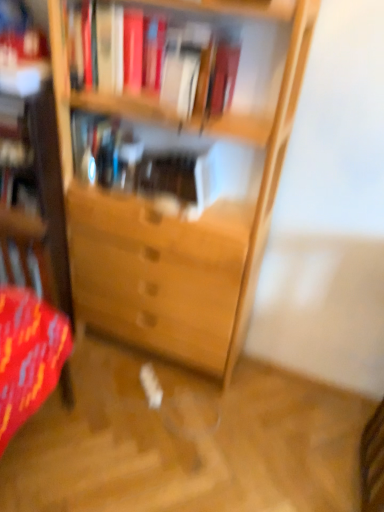
Locate an element on the screen. This screenshot has width=384, height=512. translucent glass vase at center, placed as the first book when sorted from back to front is located at coordinates (105, 151).

What do you see at coordinates (105, 151) in the screenshot? I see `translucent glass vase at center, which is counted as the second book, starting from the front` at bounding box center [105, 151].

Measure the distance between point (83, 142) and camera.

1.45 meters.

Describe the element at coordinates (160, 70) in the screenshot. I see `hardcover books at upper center, the second book viewed from the back` at that location.

This screenshot has height=512, width=384. I want to click on hardcover books at upper center, the second book viewed from the back, so click(160, 70).

Locate an element on the screen. This screenshot has height=512, width=384. translucent glass vase at center, placed as the first book when sorted from back to front is located at coordinates [105, 151].

Considering the positions of objects hardcover books at upper center, which is the first book in front-to-back order, and translucent glass vase at center, which is counted as the second book, starting from the front, in the image provided, who is more to the left, hardcover books at upper center, which is the first book in front-to-back order, or translucent glass vase at center, which is counted as the second book, starting from the front,?

Positioned to the left is translucent glass vase at center, which is counted as the second book, starting from the front.

In the scene shown: Is hardcover books at upper center, which is the first book in front-to-back order, closer to camera compared to translucent glass vase at center, placed as the first book when sorted from back to front?

Yes, the depth of hardcover books at upper center, which is the first book in front-to-back order, is less than that of translucent glass vase at center, placed as the first book when sorted from back to front.

Considering the positions of points (194, 65) and (126, 190), is point (194, 65) farther from camera compared to point (126, 190)?

No, (194, 65) is closer to viewer.

From the image's perspective, which is below, hardcover books at upper center, which is the first book in front-to-back order, or translucent glass vase at center, placed as the first book when sorted from back to front?

translucent glass vase at center, placed as the first book when sorted from back to front, is shown below in the image.

From a real-world perspective, between hardcover books at upper center, the second book viewed from the back, and translucent glass vase at center, placed as the first book when sorted from back to front, who is vertically higher?

hardcover books at upper center, the second book viewed from the back, from a real-world perspective.

Considering the sizes of hardcover books at upper center, the second book viewed from the back, and translucent glass vase at center, placed as the first book when sorted from back to front, in the image, is hardcover books at upper center, the second book viewed from the back, wider or thinner than translucent glass vase at center, placed as the first book when sorted from back to front,?

hardcover books at upper center, the second book viewed from the back, is wider than translucent glass vase at center, placed as the first book when sorted from back to front.

Looking at this image, in terms of height, does hardcover books at upper center, the second book viewed from the back, look taller or shorter compared to translucent glass vase at center, placed as the first book when sorted from back to front?

In the image, hardcover books at upper center, the second book viewed from the back, appears to be taller than translucent glass vase at center, placed as the first book when sorted from back to front.

Does hardcover books at upper center, which is the first book in front-to-back order, have a smaller size compared to translucent glass vase at center, which is counted as the second book, starting from the front?

Actually, hardcover books at upper center, which is the first book in front-to-back order, might be larger than translucent glass vase at center, which is counted as the second book, starting from the front.

Can translucent glass vase at center, which is counted as the second book, starting from the front, be found inside hardcover books at upper center, the second book viewed from the back?

No, translucent glass vase at center, which is counted as the second book, starting from the front, is located outside of hardcover books at upper center, the second book viewed from the back.

Is hardcover books at upper center, the second book viewed from the back, touching translucent glass vase at center, placed as the first book when sorted from back to front?

hardcover books at upper center, the second book viewed from the back, and translucent glass vase at center, placed as the first book when sorted from back to front, are not in contact.

Could you tell me if hardcover books at upper center, the second book viewed from the back, is facing translucent glass vase at center, which is counted as the second book, starting from the front?

No, hardcover books at upper center, the second book viewed from the back, does not turn towards translucent glass vase at center, which is counted as the second book, starting from the front.

Find the location of a particular element. book above the translucent glass vase at center, which is counted as the second book, starting from the front (from a real-world perspective) is located at coordinates (160, 70).

Which is more to the right, translucent glass vase at center, which is counted as the second book, starting from the front, or hardcover books at upper center, the second book viewed from the back?

hardcover books at upper center, the second book viewed from the back, is more to the right.

From the picture: Is the position of translucent glass vase at center, which is counted as the second book, starting from the front, less distant than that of hardcover books at upper center, which is the first book in front-to-back order?

No.

Which is farther from the camera, (83, 170) or (100, 106)?

The point (83, 170) is farther.

From the image's perspective, is translucent glass vase at center, placed as the first book when sorted from back to front, on hardcover books at upper center, the second book viewed from the back?

Actually, translucent glass vase at center, placed as the first book when sorted from back to front, appears below hardcover books at upper center, the second book viewed from the back, in the image.

From a real-world perspective, between translucent glass vase at center, placed as the first book when sorted from back to front, and hardcover books at upper center, the second book viewed from the back, who is vertically lower?

From a 3D spatial view, translucent glass vase at center, placed as the first book when sorted from back to front, is below.

Considering the relative sizes of translucent glass vase at center, placed as the first book when sorted from back to front, and hardcover books at upper center, the second book viewed from the back, in the image provided, is translucent glass vase at center, placed as the first book when sorted from back to front, wider than hardcover books at upper center, the second book viewed from the back,?

Incorrect, the width of translucent glass vase at center, placed as the first book when sorted from back to front, does not surpass that of hardcover books at upper center, the second book viewed from the back.

Does translucent glass vase at center, placed as the first book when sorted from back to front, have a lesser height compared to hardcover books at upper center, which is the first book in front-to-back order?

Yes, translucent glass vase at center, placed as the first book when sorted from back to front, is shorter than hardcover books at upper center, which is the first book in front-to-back order.

Looking at this image, which of these two, translucent glass vase at center, placed as the first book when sorted from back to front, or hardcover books at upper center, which is the first book in front-to-back order, is bigger?

hardcover books at upper center, which is the first book in front-to-back order.

Would you say translucent glass vase at center, which is counted as the second book, starting from the front, is inside or outside hardcover books at upper center, which is the first book in front-to-back order?

translucent glass vase at center, which is counted as the second book, starting from the front, is spatially situated outside hardcover books at upper center, which is the first book in front-to-back order.

Would you consider translucent glass vase at center, which is counted as the second book, starting from the front, to be distant from hardcover books at upper center, the second book viewed from the back?

Actually, translucent glass vase at center, which is counted as the second book, starting from the front, and hardcover books at upper center, the second book viewed from the back, are a little close together.

Is translucent glass vase at center, which is counted as the second book, starting from the front, facing towards hardcover books at upper center, the second book viewed from the back?

No, translucent glass vase at center, which is counted as the second book, starting from the front, is not aimed at hardcover books at upper center, the second book viewed from the back.

Looking at this image, what's the angular difference between translucent glass vase at center, which is counted as the second book, starting from the front, and hardcover books at upper center, which is the first book in front-to-back order,'s facing directions?

translucent glass vase at center, which is counted as the second book, starting from the front, and hardcover books at upper center, which is the first book in front-to-back order, are facing 0.00168 degrees away from each other.

This screenshot has width=384, height=512. Identify the location of book behind the hardcover books at upper center, which is the first book in front-to-back order. (105, 151).

This screenshot has width=384, height=512. Identify the location of book below the hardcover books at upper center, the second book viewed from the back (from a real-world perspective). (105, 151).

This screenshot has height=512, width=384. I want to click on book on the left of the hardcover books at upper center, the second book viewed from the back, so click(105, 151).